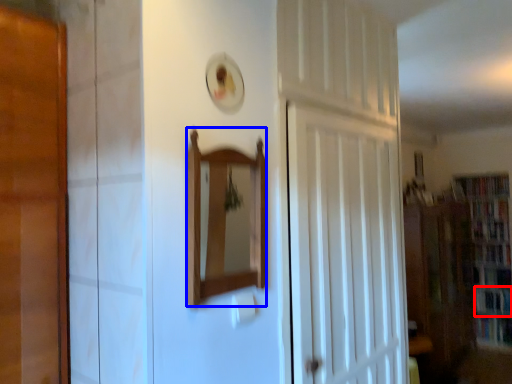
Question: Among these objects, which one is nearest to the camera, book (highlighted by a red box) or mirror (highlighted by a blue box)?

Choices:
 (A) book
 (B) mirror

Answer: (B)